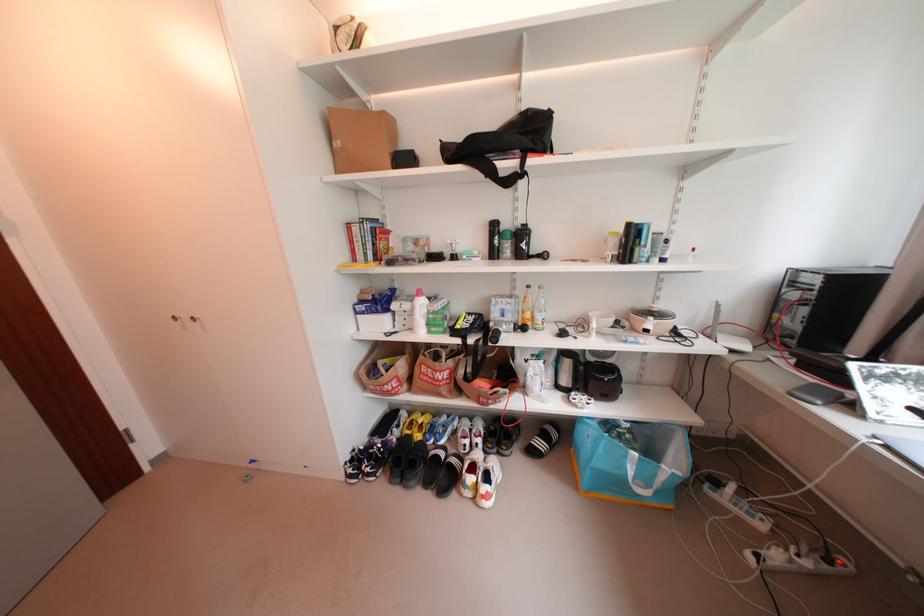
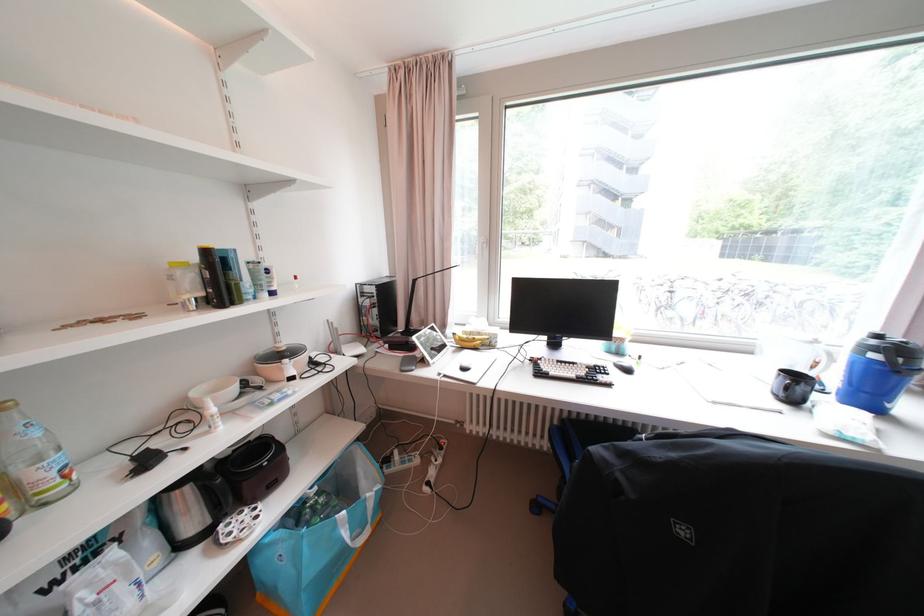
Find the pixel in the second image that matches (585,386) in the first image.

(229, 511)